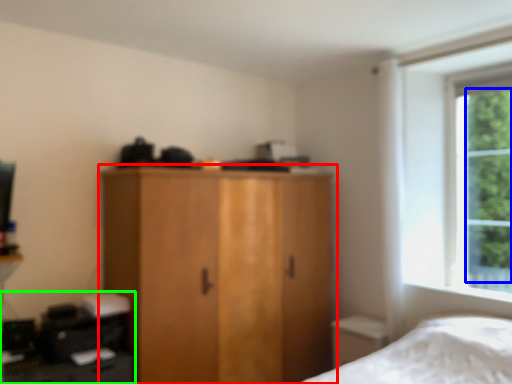
Question: Considering the real-world distances, which object is closest to cupboard (highlighted by a red box)? tree (highlighted by a blue box) or computer desk (highlighted by a green box).

Choices:
 (A) tree
 (B) computer desk

Answer: (B)